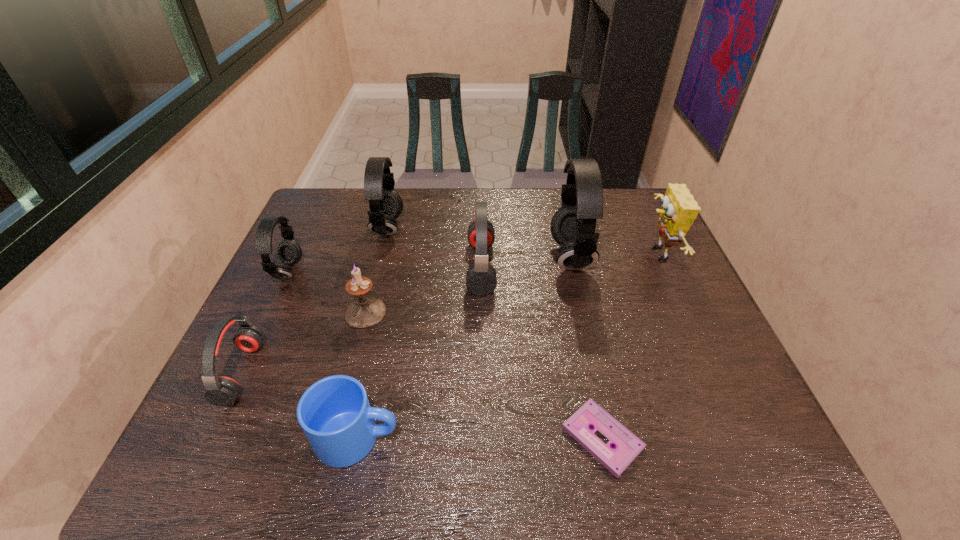
Where is `candle holder`? This screenshot has height=540, width=960. candle holder is located at coordinates (365, 312).

The height and width of the screenshot is (540, 960). I want to click on the smaller red earphone, so click(x=222, y=391).

Image resolution: width=960 pixels, height=540 pixels. In order to click on the nearest earphone in this screenshot , I will do pos(222,391).

Locate an element on the screen. mug is located at coordinates pos(334,413).

This screenshot has height=540, width=960. I want to click on the shortest object, so click(627, 446).

I want to click on free space located on the ear cups of the rightmost black earphone, so click(x=507, y=256).

Identify the location of free space located 0.340m on the ear cups of the rightmost black earphone. (436, 256).

Identify the location of vacant point located on the ear cups of the rightmost black earphone. This screenshot has height=540, width=960. (422, 256).

The width and height of the screenshot is (960, 540). Find the location of `free region located on the ear cups of the second black earphone from left to right`. free region located on the ear cups of the second black earphone from left to right is located at coordinates (424, 229).

Locate an element on the screen. The image size is (960, 540). free region located 0.280m on the face of the rightmost object is located at coordinates (549, 253).